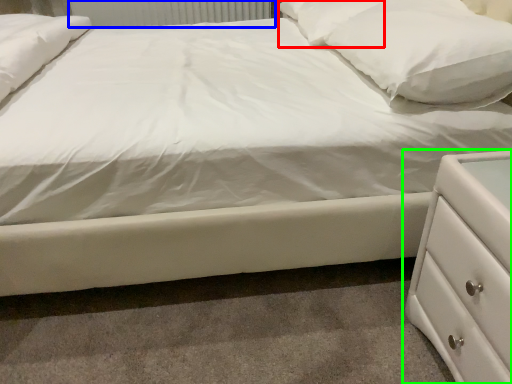
Question: Which object is the farthest from pillow (highlighted by a red box)? Choose among these: radiator (highlighted by a blue box) or chest of drawers (highlighted by a green box).

Choices:
 (A) radiator
 (B) chest of drawers

Answer: (A)